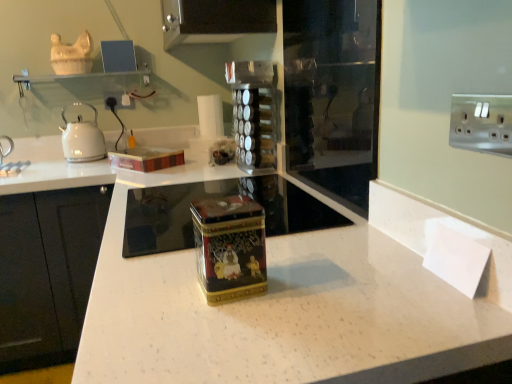
Question: Is clear glass shelf at upper center in front of or behind white plastic electric outlet at upper right in the image?

Choices:
 (A) behind
 (B) front

Answer: (B)

Question: Visually, is clear glass shelf at upper center positioned to the left or to the right of white plastic electric outlet at upper right?

Choices:
 (A) right
 (B) left

Answer: (B)

Question: Considering the real-world distances, which object is farthest from the transparent glass door at center?

Choices:
 (A) gold metallic tin at center
 (B) white glossy kettle at left
 (C) white plastic electric outlet at upper right
 (D) wooden box at upper center
 (E) clear glass shelf at upper center

Answer: (B)

Question: Considering the real-world distances, which object is farthest from the clear plastic spice rack at center?

Choices:
 (A) transparent glass door at center
 (B) gold metallic tin at center
 (C) white speckled granite at center
 (D) white plastic electric outlet at upper right
 (E) wooden box at upper center

Answer: (D)